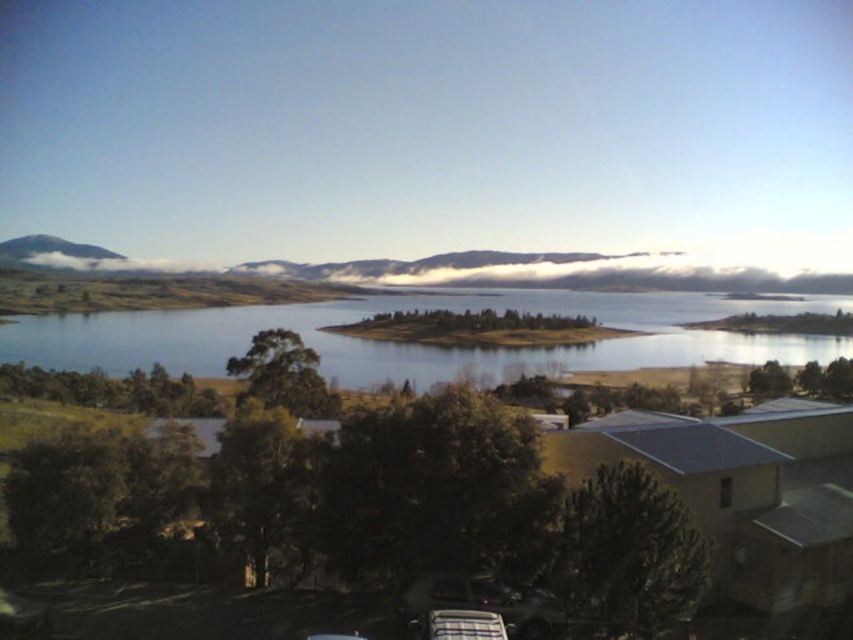
Is clear blue water at center closer to the viewer compared to metallic silver car at lower center?

No, clear blue water at center is behind metallic silver car at lower center.

Can you confirm if clear blue water at center is positioned to the right of metallic silver car at lower center?

Indeed, clear blue water at center is positioned on the right side of metallic silver car at lower center.

Which is behind, point (561, 368) or point (497, 630)?

Positioned behind is point (561, 368).

Where is `clear blue water at center`? This screenshot has width=853, height=640. clear blue water at center is located at coordinates (419, 344).

Which of these two, white fluffy clouds at center or smooth gray mountain at upper left, stands shorter?

With less height is smooth gray mountain at upper left.

Is white fluffy clouds at center to the right of smooth gray mountain at upper left from the viewer's perspective?

Correct, you'll find white fluffy clouds at center to the right of smooth gray mountain at upper left.

Is point (532, 256) positioned after point (27, 237)?

No, it is in front of (27, 237).

The width and height of the screenshot is (853, 640). Identify the location of white fluffy clouds at center. (555, 273).

Does point (494, 632) come farther from viewer compared to point (114, 253)?

No.

Find the location of a particular element. The height and width of the screenshot is (640, 853). metallic silver car at lower center is located at coordinates (465, 625).

You are a GUI agent. You are given a task and a screenshot of the screen. Output one action in this format:
    pyautogui.click(x=<x>, y=<y>)
    Task: Click on the metallic silver car at lower center
    
    Given the screenshot: What is the action you would take?
    pyautogui.click(x=465, y=625)